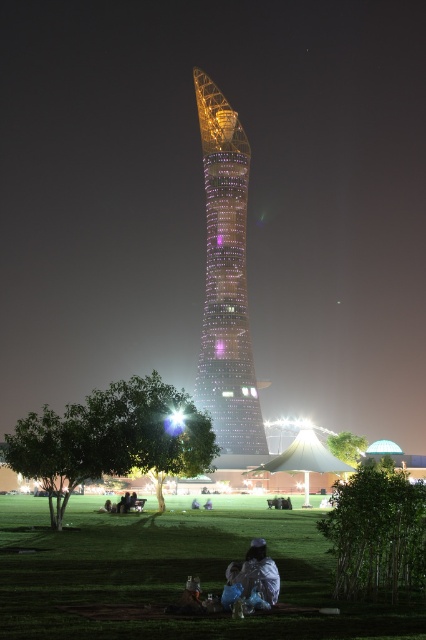
Question: Based on their relative distances, which object is farther from the white fabric bag at lower center?

Choices:
 (A) shiny glass tower at center
 (B) green grass at lower center

Answer: (A)

Question: Considering the relative positions of green grass at lower center and shiny glass tower at center in the image provided, where is green grass at lower center located with respect to shiny glass tower at center?

Choices:
 (A) right
 (B) left

Answer: (B)

Question: Which point is farther from the camera taking this photo?

Choices:
 (A) (88, 636)
 (B) (273, 588)

Answer: (B)

Question: Is shiny glass tower at center wider than white fabric bag at lower center?

Choices:
 (A) yes
 (B) no

Answer: (A)

Question: Which point is closer to the camera?

Choices:
 (A) green grass at lower center
 (B) shiny glass tower at center
 (C) white fabric bag at lower center

Answer: (A)

Question: Considering the relative positions of green grass at lower center and shiny glass tower at center in the image provided, where is green grass at lower center located with respect to shiny glass tower at center?

Choices:
 (A) left
 (B) right

Answer: (A)